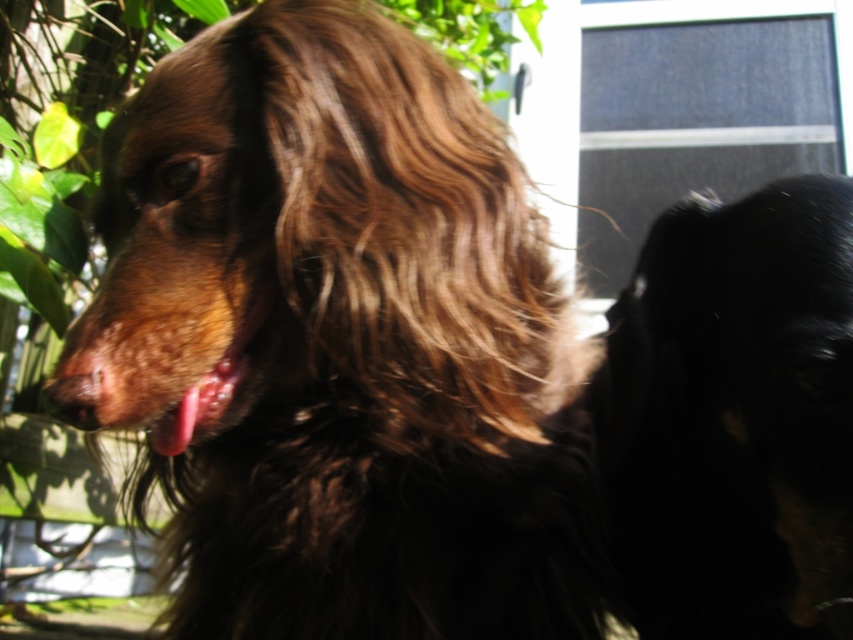
Is black fur dog at right wider than brown fuzzy nose at center?

Yes.

What do you see at coordinates (734, 417) in the screenshot? The image size is (853, 640). I see `black fur dog at right` at bounding box center [734, 417].

In order to click on black fur dog at right in this screenshot , I will do `click(734, 417)`.

Is blue fabric screen door at upper right below brown fuzzy nose at center?

Incorrect, blue fabric screen door at upper right is not positioned below brown fuzzy nose at center.

Who is lower down, blue fabric screen door at upper right or brown fuzzy nose at center?

Positioned lower is brown fuzzy nose at center.

Where is `blue fabric screen door at upper right`? The image size is (853, 640). blue fabric screen door at upper right is located at coordinates (695, 122).

Describe the element at coordinates (734, 417) in the screenshot. The image size is (853, 640). I see `black fur dog at right` at that location.

Does black fur dog at right have a lesser height compared to pink glossy tongue at center?

No.

Find the location of a particular element. black fur dog at right is located at coordinates (734, 417).

Where is `black fur dog at right`? black fur dog at right is located at coordinates (734, 417).